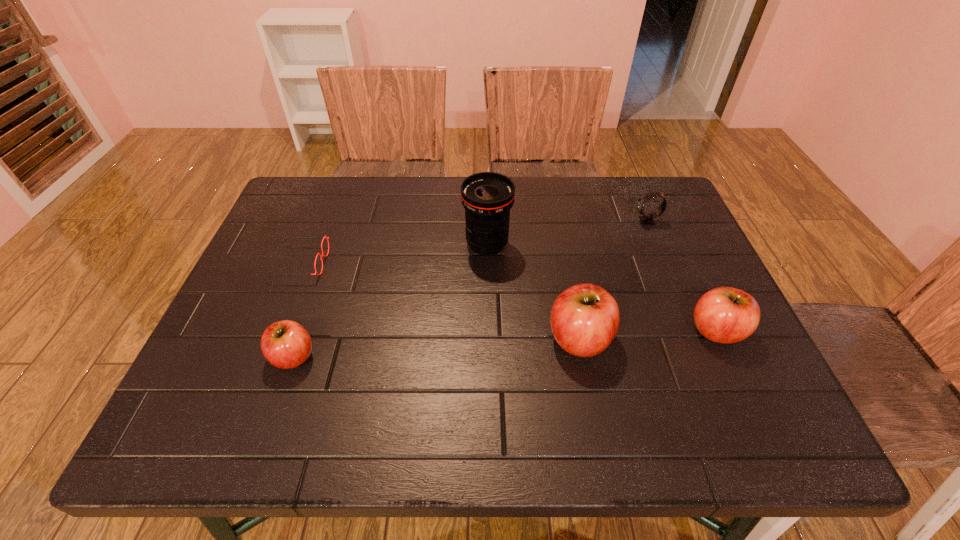
In order to click on free space for an extra apple to achieve even spacing in this screenshot , I will do `click(439, 347)`.